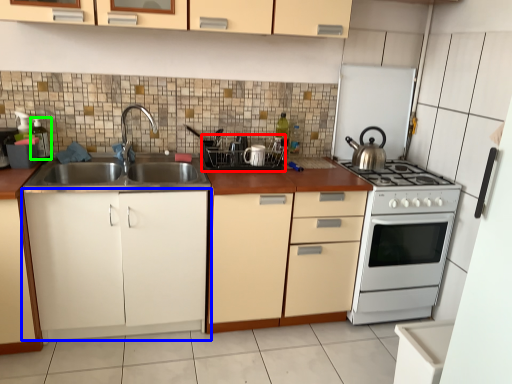
Question: Based on their relative distances, which object is nearer to appliance (highlighted by a red box)? Choose from cabinetry (highlighted by a blue box) and appliance (highlighted by a green box).

Choices:
 (A) cabinetry
 (B) appliance

Answer: (A)